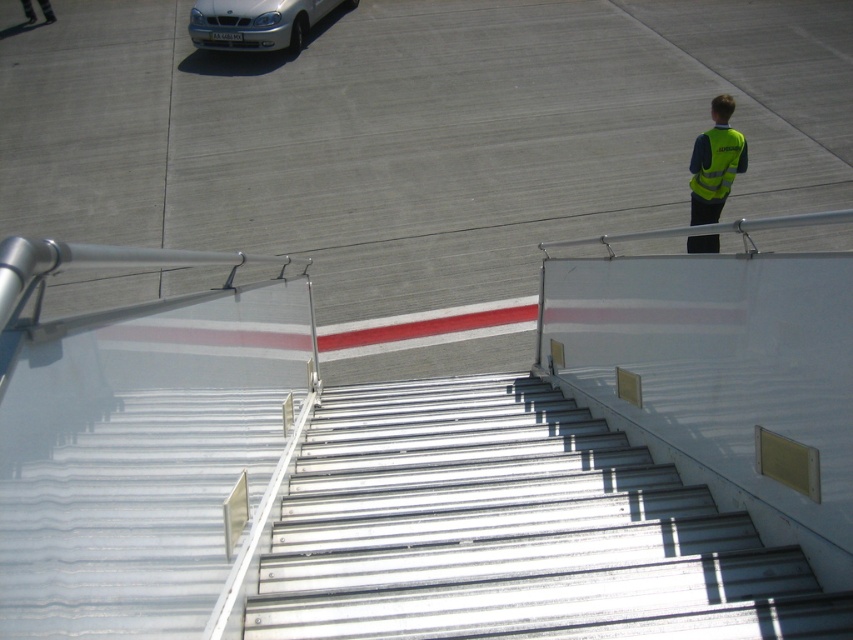
Does point (242, 4) come behind point (717, 131)?

Yes, it is.

Which is behind, point (218, 8) or point (722, 163)?

Positioned behind is point (218, 8).

Image resolution: width=853 pixels, height=640 pixels. In order to click on silver metallic car at upper left in this screenshot , I will do `click(257, 22)`.

Is white metallic stairs at center to the right of yellow reflective vest at upper right from the viewer's perspective?

No, white metallic stairs at center is not to the right of yellow reflective vest at upper right.

Is white metallic stairs at center to the left of yellow reflective vest at upper right from the viewer's perspective?

Correct, you'll find white metallic stairs at center to the left of yellow reflective vest at upper right.

Which is behind, point (415, 240) or point (711, 132)?

Point (415, 240)

Identify the location of white metallic stairs at center. (415, 132).

Is the position of metallic silver stairs at center more distant than that of yellow reflective vest at upper right?

No, metallic silver stairs at center is in front of yellow reflective vest at upper right.

Identify the location of metallic silver stairs at center. The image size is (853, 640). (512, 529).